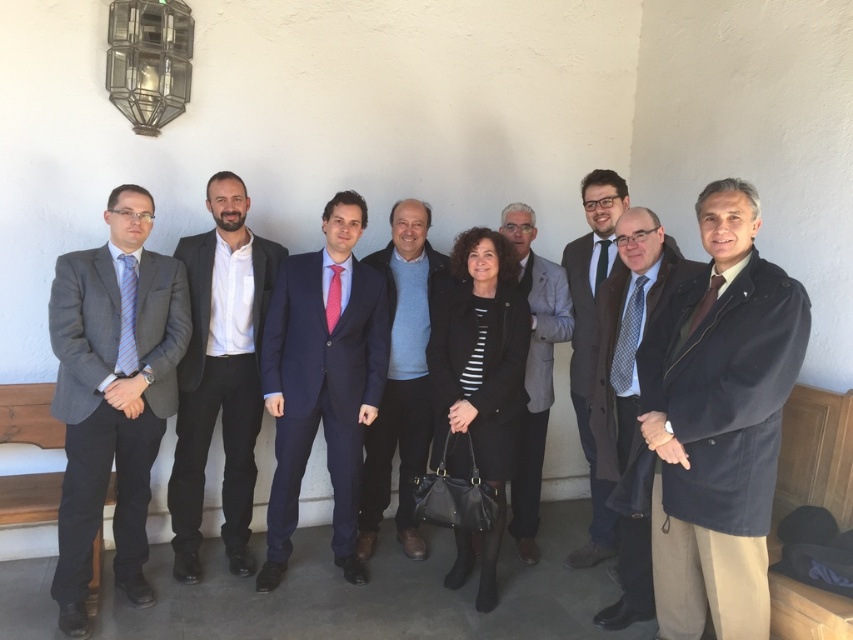
You are organizing a photo shoot and need to ensure there is enough space between the black leather coat at center and the gray wool suit at center for a camera to fit between them. The camera requires at least 30 centimeters of space. Can the camera fit between them?

The black leather coat at center and gray wool suit at center are 35.10 centimeters apart from each other, which is more than the required 30 centimeters. The camera can fit between them.

From the picture: You are a photographer trying to capture a clear shot of the navy blue suit at center and the black leather coat at center. Since both are at the center, how can you determine which one is closer to the camera?

The navy blue suit at center is located above the black leather coat at center, so the navy blue suit at center is closer to the camera.

You are standing in front of the group of nine people. You notice two points marked in the image. Which point, point (492, 563) or point (556, 317), is closer to you?

Point (492, 563) is closer to the viewer than point (556, 317).